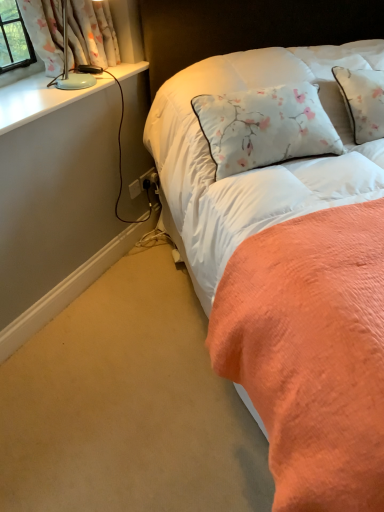
At what (x,y) coordinates should I click in order to perform the action: click on floral fabric pillow at upper right. Please return your answer as a coordinate pair (x, y). Looking at the image, I should click on (334, 78).

Image resolution: width=384 pixels, height=512 pixels. Identify the location of white plastic electrical outlet at lower center. (146, 176).

Image resolution: width=384 pixels, height=512 pixels. I want to click on white floral fabric at upper left, so click(91, 34).

Describe the element at coordinates (91, 34) in the screenshot. I see `white floral fabric at upper left` at that location.

Identify the location of floral fabric pillow at upper right. The height and width of the screenshot is (512, 384). (334, 78).

Does white floral fabric at upper left come in front of white plastic electrical outlet at lower center?

Yes, it is in front of white plastic electrical outlet at lower center.

Can you tell me how much white floral fabric at upper left and white plastic electrical outlet at lower center differ in facing direction?

white floral fabric at upper left and white plastic electrical outlet at lower center are facing 2.19 degrees away from each other.

Can you confirm if white floral fabric at upper left is bigger than white plastic electrical outlet at lower center?

Indeed, white floral fabric at upper left has a larger size compared to white plastic electrical outlet at lower center.

Can you confirm if white floral fabric at upper left is taller than white glossy window sill at upper left?

Yes, white floral fabric at upper left is taller than white glossy window sill at upper left.

Which of these two, white floral fabric at upper left or white glossy window sill at upper left, is bigger?

white floral fabric at upper left.

Which object is further away from the camera, white floral fabric at upper left or white glossy window sill at upper left?

Positioned behind is white floral fabric at upper left.

Is there a large distance between white glossy window sill at upper left and white floral fabric at upper left?

white glossy window sill at upper left is actually quite close to white floral fabric at upper left.

Measure the distance between white glossy window sill at upper left and white floral fabric at upper left.

A distance of 8.20 inches exists between white glossy window sill at upper left and white floral fabric at upper left.

Which of these two, white glossy window sill at upper left or white floral fabric at upper left, is bigger?

white floral fabric at upper left.

In the image, is white glossy window sill at upper left on the left side or the right side of white floral fabric at upper left?

In the image, white glossy window sill at upper left appears on the left side of white floral fabric at upper left.

Find the location of `electric outlet below the floral fabric pillow at upper right (from a real-world perspective)`. electric outlet below the floral fabric pillow at upper right (from a real-world perspective) is located at coordinates (146, 176).

Does floral fabric pillow at upper right have a greater height compared to white plastic electrical outlet at lower center?

Correct, floral fabric pillow at upper right is much taller as white plastic electrical outlet at lower center.

How different are the orientations of floral fabric pillow at upper right and white plastic electrical outlet at lower center in degrees?

There is a 44.3-degree angle between the facing directions of floral fabric pillow at upper right and white plastic electrical outlet at lower center.

Considering the positions of objects floral fabric pillow at upper right and white plastic electrical outlet at lower center in the image provided, who is more to the left, floral fabric pillow at upper right or white plastic electrical outlet at lower center?

white plastic electrical outlet at lower center.

Is white floral fabric at upper left facing towards floral fabric pillow at upper right?

Yes.

Which point is more distant from viewer, (62, 48) or (332, 52)?

The point (332, 52) is farther from the camera.

Considering the relative sizes of white floral fabric at upper left and floral fabric pillow at upper right in the image provided, is white floral fabric at upper left shorter than floral fabric pillow at upper right?

Correct, white floral fabric at upper left is not as tall as floral fabric pillow at upper right.

You are a GUI agent. You are given a task and a screenshot of the screen. Output one action in this format:
    pyautogui.click(x=<x>, y=<y>)
    Task: Click on the pillow that appears below the white floral fabric at upper left (from the image's perspective)
    The image size is (384, 512).
    Given the screenshot: What is the action you would take?
    pyautogui.click(x=334, y=78)

Is white floral fabric at upper left oriented towards white plastic power outlet at lower center?

No, white floral fabric at upper left is not turned towards white plastic power outlet at lower center.

Does white floral fabric at upper left contain white plastic power outlet at lower center?

No, white plastic power outlet at lower center is not surrounded by white floral fabric at upper left.

In terms of size, does white floral fabric at upper left appear bigger or smaller than white plastic power outlet at lower center?

white floral fabric at upper left is bigger than white plastic power outlet at lower center.

From the image's perspective, which object appears higher, white floral fabric at upper left or white plastic power outlet at lower center?

From the image's view, white floral fabric at upper left is above.

Where is `electric outlet below the white floral fabric at upper left (from a real-world perspective)`? electric outlet below the white floral fabric at upper left (from a real-world perspective) is located at coordinates (146, 176).

Is white plastic electrical outlet at lower center far away from white floral fabric at upper left?

That's not correct — white plastic electrical outlet at lower center is a little close to white floral fabric at upper left.

Between white plastic electrical outlet at lower center and white floral fabric at upper left, which one appears on the left side from the viewer's perspective?

Positioned to the left is white floral fabric at upper left.

Looking at this image, how much distance is there between white plastic electrical outlet at lower center and white floral fabric at upper left?

They are 30.40 inches apart.

Identify the location of curtain that is above the white plastic electrical outlet at lower center (from a real-world perspective). (91, 34).

The width and height of the screenshot is (384, 512). Find the location of `window sill below the white floral fabric at upper left (from the image's perspective)`. window sill below the white floral fabric at upper left (from the image's perspective) is located at coordinates (38, 99).

Based on their spatial positions, is white plastic power outlet at lower center or white floral fabric at upper left further from white plastic electrical outlet at lower center?

white floral fabric at upper left.

Looking at the image, which one is located further to white plastic power outlet at lower center, white plastic electrical outlet at lower center or floral fabric pillow at upper right?

Based on the image, floral fabric pillow at upper right appears to be further to white plastic power outlet at lower center.

Based on their spatial positions, is white floral fabric at upper left or white plastic power outlet at lower center further from floral fabric pillow at upper right?

white plastic power outlet at lower center is further to floral fabric pillow at upper right.

Looking at the image, which one is located further to white plastic power outlet at lower center, white floral fabric at upper left or floral fabric pillow at upper right?

Based on the image, floral fabric pillow at upper right appears to be further to white plastic power outlet at lower center.

From the image, which object appears to be nearer to floral fabric pillow at upper right, white plastic electrical outlet at lower center or white glossy window sill at upper left?

white glossy window sill at upper left is positioned closer to the anchor floral fabric pillow at upper right.

When comparing their distances from white plastic power outlet at lower center, does white floral fabric at upper left or white plastic electrical outlet at lower center seem closer?

Based on the image, white plastic electrical outlet at lower center appears to be nearer to white plastic power outlet at lower center.

From the image, which object appears to be farther from white glossy window sill at upper left, white plastic power outlet at lower center or floral fabric pillow at upper right?

floral fabric pillow at upper right is positioned further to the anchor white glossy window sill at upper left.

Which object lies nearer to the anchor point white glossy window sill at upper left, white plastic electrical outlet at lower center or floral fabric pillow at upper right?

white plastic electrical outlet at lower center is positioned closer to the anchor white glossy window sill at upper left.

You are a GUI agent. You are given a task and a screenshot of the screen. Output one action in this format:
    pyautogui.click(x=<x>, y=<y>)
    Task: Click on the curtain between white glossy window sill at upper left and white plastic electrical outlet at lower center from front to back
    Image resolution: width=384 pixels, height=512 pixels.
    Given the screenshot: What is the action you would take?
    pyautogui.click(x=91, y=34)

The width and height of the screenshot is (384, 512). What are the coordinates of `electric outlet between white floral fabric at upper left and floral fabric pillow at upper right in the horizontal direction` in the screenshot? It's located at (146, 176).

Locate an element on the screen. Image resolution: width=384 pixels, height=512 pixels. power outlet between white floral fabric at upper left and white plastic electrical outlet at lower center along the z-axis is located at coordinates (135, 188).

The image size is (384, 512). What are the coordinates of `power outlet located between white glossy window sill at upper left and floral fabric pillow at upper right in the left-right direction` in the screenshot? It's located at (135, 188).